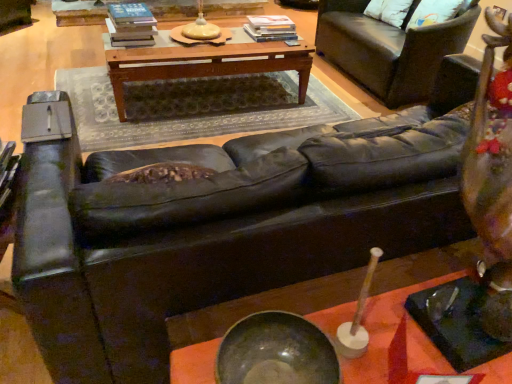
The width and height of the screenshot is (512, 384). Identify the location of metallic bowl at center, the first table ordered from the bottom. (396, 340).

What are the coordinates of `woodenobject at center, the second table from the bottom` in the screenshot? It's located at (204, 62).

This screenshot has height=384, width=512. What do you see at coordinates (276, 352) in the screenshot?
I see `shiny metallic bowl at center` at bounding box center [276, 352].

Describe the element at coordinates (389, 11) in the screenshot. The height and width of the screenshot is (384, 512). I see `white soft pillow at upper right` at that location.

What do you see at coordinates (389, 49) in the screenshot? This screenshot has width=512, height=384. I see `black leather couch at upper right` at bounding box center [389, 49].

In the scene shown: In order to face black leather couch at upper right, should I rotate leftwards or rightwards?

Rotate your view right by about 18.273°.

Describe the element at coordinates (193, 107) in the screenshot. This screenshot has width=512, height=384. I see `dark brown leather mat at center` at that location.

The width and height of the screenshot is (512, 384). What are the coordinates of `metallic bowl at center, placed as the first table when sorted from front to back` in the screenshot? It's located at (396, 340).

Is black leather couch at upper right smaller than shiny metallic bowl at center?

No, black leather couch at upper right is not smaller than shiny metallic bowl at center.

Between black leather couch at upper right and shiny metallic bowl at center, which one is positioned in front?

shiny metallic bowl at center is in front.

Which is closer to the camera, (353, 16) or (279, 378)?

The point (279, 378) is more forward.

Is black leather couch at upper right to the left or to the right of shiny metallic bowl at center in the image?

black leather couch at upper right is positioned on shiny metallic bowl at center's right side.

From the image's perspective, which one is positioned higher, metallic bowl at center, placed as the first table when sorted from front to back, or woodenobject at center, placed as the second table when sorted from front to back?

woodenobject at center, placed as the second table when sorted from front to back, appears higher in the image.

Would you say metallic bowl at center, the first table ordered from the bottom, is outside woodenobject at center, which is the first table in back-to-front order?

Indeed, metallic bowl at center, the first table ordered from the bottom, is completely outside woodenobject at center, which is the first table in back-to-front order.

Considering the sizes of objects metallic bowl at center, the 2th table when ordered from top to bottom, and woodenobject at center, the first table in the top-to-bottom sequence, in the image provided, who is wider, metallic bowl at center, the 2th table when ordered from top to bottom, or woodenobject at center, the first table in the top-to-bottom sequence,?

woodenobject at center, the first table in the top-to-bottom sequence.

Considering the relative positions of dark brown leather mat at center and woodenobject at center, placed as the second table when sorted from front to back, in the image provided, is dark brown leather mat at center to the left of woodenobject at center, placed as the second table when sorted from front to back, from the viewer's perspective?

Yes.

Which object is wider, dark brown leather mat at center or woodenobject at center, which is the first table in back-to-front order?

With larger width is dark brown leather mat at center.

The height and width of the screenshot is (384, 512). I want to click on mat below the woodenobject at center, placed as the second table when sorted from front to back (from the image's perspective), so click(x=193, y=107).

Is dark brown leather mat at center directly adjacent to woodenobject at center, which is the first table in back-to-front order?

No, dark brown leather mat at center is not with woodenobject at center, which is the first table in back-to-front order.

Is white soft pillow at upper right aimed at metallic bowl at center, the first table ordered from the bottom?

No, white soft pillow at upper right is not aimed at metallic bowl at center, the first table ordered from the bottom.

Looking at this image, considering the relative positions of white soft pillow at upper right and metallic bowl at center, the 2th table when ordered from top to bottom, in the image provided, is white soft pillow at upper right to the left or to the right of metallic bowl at center, the 2th table when ordered from top to bottom,?

white soft pillow at upper right is positioned on metallic bowl at center, the 2th table when ordered from top to bottom,'s right side.

From the image's perspective, is white soft pillow at upper right on top of metallic bowl at center, placed as the first table when sorted from front to back?

Yes, from the image's perspective, white soft pillow at upper right is on top of metallic bowl at center, placed as the first table when sorted from front to back.

Locate an element on the screen. This screenshot has width=512, height=384. pillow located above the metallic bowl at center, placed as the 2th table when sorted from back to front (from a real-world perspective) is located at coordinates (389, 11).

Is metallic bowl at center, the 2th table when ordered from top to bottom, aimed at shiny metallic bowl at center?

No, metallic bowl at center, the 2th table when ordered from top to bottom, does not turn towards shiny metallic bowl at center.

Who is taller, metallic bowl at center, the 2th table when ordered from top to bottom, or shiny metallic bowl at center?

With more height is metallic bowl at center, the 2th table when ordered from top to bottom.

From the image's perspective, is metallic bowl at center, placed as the 2th table when sorted from back to front, on top of shiny metallic bowl at center?

No, from the image's perspective, metallic bowl at center, placed as the 2th table when sorted from back to front, is not above shiny metallic bowl at center.

Is metallic bowl at center, placed as the 2th table when sorted from back to front, further to camera compared to dark brown leather mat at center?

No, it is not.

Is metallic bowl at center, placed as the first table when sorted from front to back, at the right side of dark brown leather mat at center?

Indeed, metallic bowl at center, placed as the first table when sorted from front to back, is positioned on the right side of dark brown leather mat at center.

Which is less distant, (345, 379) or (194, 84)?

Point (345, 379).

The height and width of the screenshot is (384, 512). I want to click on mat located above the metallic bowl at center, placed as the first table when sorted from front to back (from the image's perspective), so click(x=193, y=107).

How many degrees apart are the facing directions of white soft pillow at upper right and dark brown leather mat at center?

The angle between the facing direction of white soft pillow at upper right and the facing direction of dark brown leather mat at center is 76.8 degrees.

From the image's perspective, is white soft pillow at upper right on top of dark brown leather mat at center?

Yes, from the image's perspective, white soft pillow at upper right is over dark brown leather mat at center.

Between white soft pillow at upper right and dark brown leather mat at center, which one has more height?

white soft pillow at upper right is taller.

Is dark brown leather mat at center a part of white soft pillow at upper right?

Actually, dark brown leather mat at center is outside white soft pillow at upper right.

Locate an element on the screen. Image resolution: width=512 pixels, height=384 pixels. bowl that is in front of the black leather couch at upper right is located at coordinates (276, 352).

Find the location of a particular element. The image size is (512, 384). table on the right of woodenobject at center, the second table from the bottom is located at coordinates (396, 340).

Based on their spatial positions, is dark brown leather mat at center or metallic bowl at center, placed as the 2th table when sorted from back to front, closer to white soft pillow at upper right?

dark brown leather mat at center is closer to white soft pillow at upper right.

Considering their positions, is black leather couch at upper right positioned further to metallic bowl at center, the 2th table when ordered from top to bottom, than dark brown leather mat at center?

Based on the image, black leather couch at upper right appears to be further to metallic bowl at center, the 2th table when ordered from top to bottom.

Estimate the real-world distances between objects in this image. Which object is further from white soft pillow at upper right, woodenobject at center, which is the first table in back-to-front order, or black leather couch at upper right?

The object further to white soft pillow at upper right is woodenobject at center, which is the first table in back-to-front order.

Which object lies nearer to the anchor point white soft pillow at upper right, metallic bowl at center, placed as the first table when sorted from front to back, or dark brown leather mat at center?

dark brown leather mat at center.

Looking at the image, which one is located further to woodenobject at center, which is the first table in back-to-front order, shiny metallic bowl at center or dark brown leather mat at center?

The object further to woodenobject at center, which is the first table in back-to-front order, is shiny metallic bowl at center.

When comparing their distances from shiny metallic bowl at center, does woodenobject at center, placed as the second table when sorted from front to back, or white soft pillow at upper right seem closer?

The object closer to shiny metallic bowl at center is woodenobject at center, placed as the second table when sorted from front to back.

Looking at the image, which one is located further to shiny metallic bowl at center, metallic bowl at center, the first table ordered from the bottom, or woodenobject at center, which is the first table in back-to-front order?

woodenobject at center, which is the first table in back-to-front order.

Looking at the image, which one is located closer to dark brown leather mat at center, woodenobject at center, the first table in the top-to-bottom sequence, or shiny metallic bowl at center?

Among the two, woodenobject at center, the first table in the top-to-bottom sequence, is located nearer to dark brown leather mat at center.

Where is `studio couch between shiny metallic bowl at center and white soft pillow at upper right from front to back`? studio couch between shiny metallic bowl at center and white soft pillow at upper right from front to back is located at coordinates 389,49.

Locate an element on the screen. Image resolution: width=512 pixels, height=384 pixels. mat between shiny metallic bowl at center and white soft pillow at upper right from front to back is located at coordinates (193, 107).

Where is `table located between shiny metallic bowl at center and woodenobject at center, the first table in the top-to-bottom sequence, in the depth direction`? table located between shiny metallic bowl at center and woodenobject at center, the first table in the top-to-bottom sequence, in the depth direction is located at coordinates (396, 340).

Where is `mat between metallic bowl at center, placed as the first table when sorted from front to back, and black leather couch at upper right from front to back`? The image size is (512, 384). mat between metallic bowl at center, placed as the first table when sorted from front to back, and black leather couch at upper right from front to back is located at coordinates (193, 107).